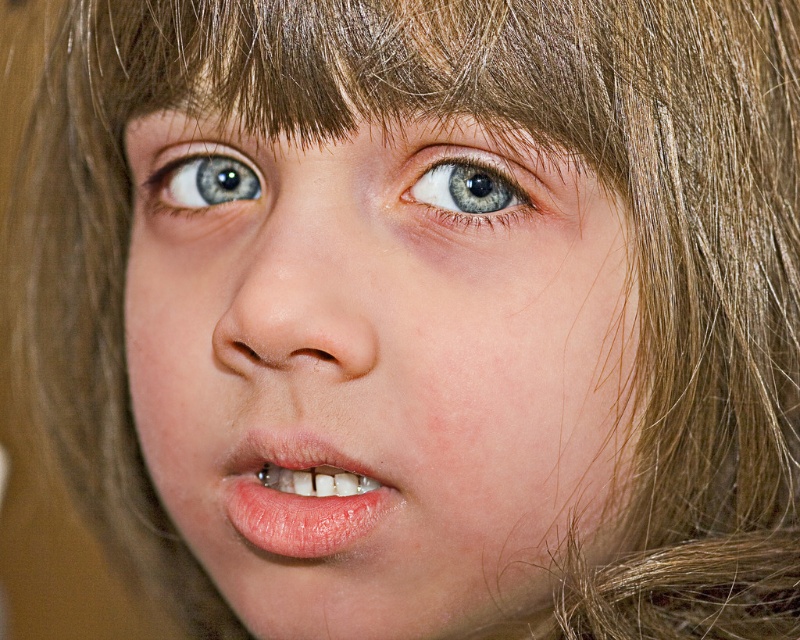
Describe the element at coordinates (382, 369) in the screenshot. The width and height of the screenshot is (800, 640). I see `smooth skin face at center` at that location.

Does smooth skin face at center have a greater width compared to blue glossy eye at upper left?

Indeed, smooth skin face at center has a greater width compared to blue glossy eye at upper left.

Which is behind, point (601, 456) or point (212, 163)?

The point (212, 163) is more distant.

You are a GUI agent. You are given a task and a screenshot of the screen. Output one action in this format:
    pyautogui.click(x=<x>, y=<y>)
    Task: Click on the smooth skin face at center
    This screenshot has height=640, width=800.
    Given the screenshot: What is the action you would take?
    pyautogui.click(x=382, y=369)

Can you confirm if pink glossy lips at center is smaller than blue glossy eye at center?

No, pink glossy lips at center is not smaller than blue glossy eye at center.

Is point (264, 465) more distant than point (422, 172)?

That is True.

In the scene shown: Who is more distant from viewer, (244, 513) or (428, 164)?

Point (244, 513)

In order to click on pink glossy lips at center in this screenshot , I will do `click(302, 493)`.

Between point (306, 532) and point (164, 180), which one is positioned behind?

The point (164, 180) is more distant.

In the scene shown: Who is more distant from viewer, (304, 516) or (216, 176)?

Point (216, 176)

At what (x,y) coordinates should I click in order to perform the action: click on pink glossy lips at center. Please return your answer as a coordinate pair (x, y). The width and height of the screenshot is (800, 640). Looking at the image, I should click on (302, 493).